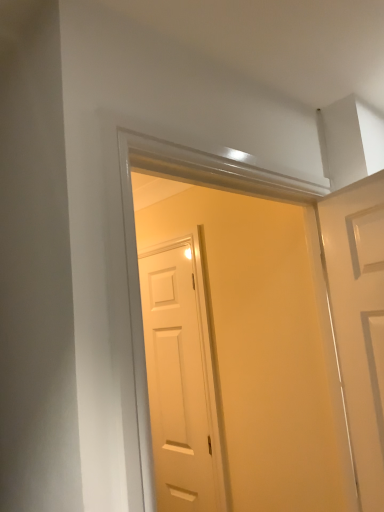
What is the approximate height of white wooden door at center?

3.93 feet.

The image size is (384, 512). In order to click on white wooden door at center in this screenshot , I will do `click(261, 337)`.

What do you see at coordinates (261, 337) in the screenshot?
I see `white wooden door at center` at bounding box center [261, 337].

Locate an element on the screen. The width and height of the screenshot is (384, 512). white wooden door at center is located at coordinates (261, 337).